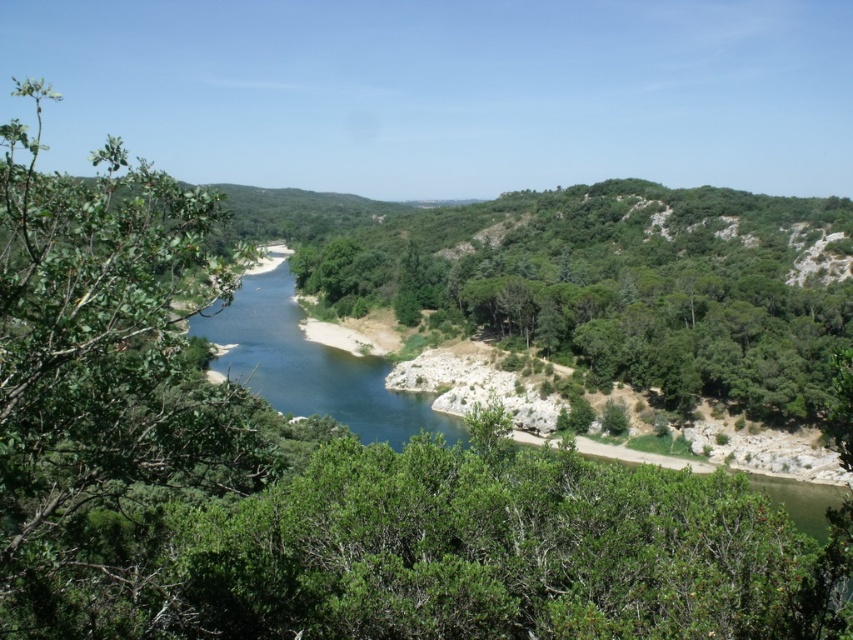
Question: From the image, what is the correct spatial relationship of blue water at center in relation to blue smooth river at center?

Choices:
 (A) right
 (B) left

Answer: (A)

Question: Where is blue water at center located in relation to blue smooth river at center in the image?

Choices:
 (A) left
 (B) right

Answer: (B)

Question: Where is blue water at center located in relation to blue smooth river at center in the image?

Choices:
 (A) above
 (B) below

Answer: (B)

Question: Among these objects, which one is nearest to the camera?

Choices:
 (A) blue water at center
 (B) blue smooth river at center

Answer: (A)